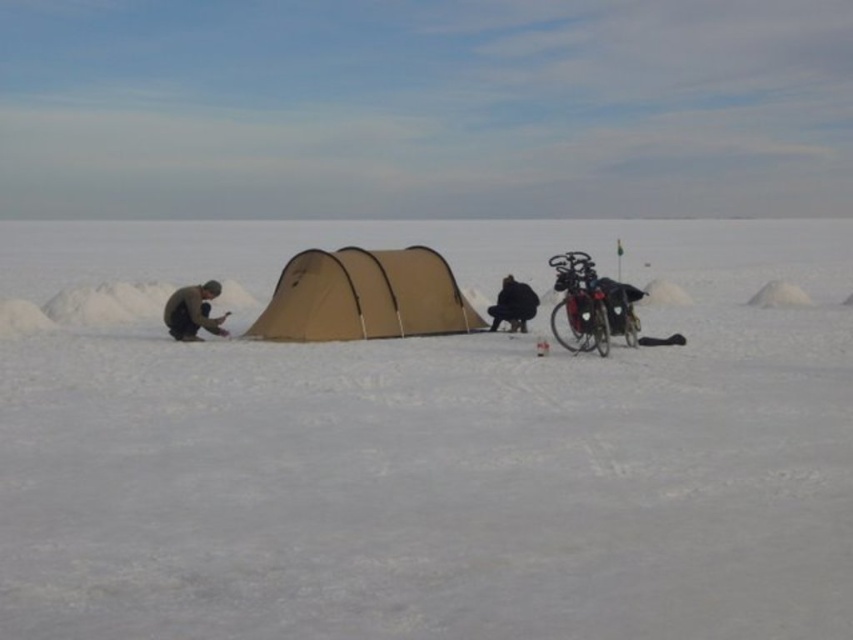
Question: Is white matte snow at center to the right of black fabric person at center from the viewer's perspective?

Choices:
 (A) no
 (B) yes

Answer: (A)

Question: Among these points, which one is nearest to the camera?

Choices:
 (A) (334, 330)
 (B) (494, 317)
 (C) (206, 289)

Answer: (A)

Question: Which of the following is the farthest from the observer?

Choices:
 (A) black fabric person at center
 (B) brown woolen sweater at left
 (C) white matte snow at center

Answer: (A)

Question: Based on their relative distances, which object is nearer to the brown woolen sweater at left?

Choices:
 (A) black fabric person at center
 (B) white matte snow at center
 (C) tan fabric tent at center

Answer: (C)

Question: Can you confirm if white matte snow at center is thinner than tan fabric tent at center?

Choices:
 (A) yes
 (B) no

Answer: (B)

Question: Observing the image, what is the correct spatial positioning of tan fabric tent at center in reference to black fabric person at center?

Choices:
 (A) left
 (B) right

Answer: (A)